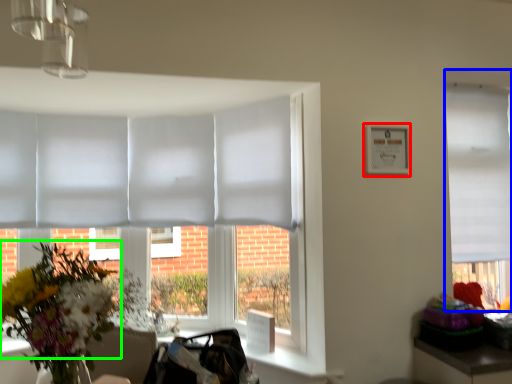
Question: Estimate the real-world distances between objects in this image. Which object is farther from picture frame (highlighted by a red box), window (highlighted by a blue box) or flower (highlighted by a green box)?

Choices:
 (A) window
 (B) flower

Answer: (B)